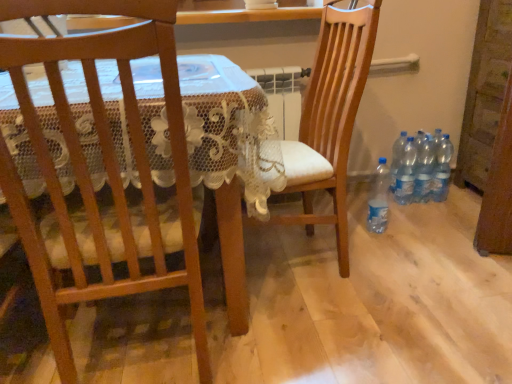
Locate an element on the screen. This screenshot has width=512, height=384. vacant area that lies between wooden chair at center, the 2th chair from the left, and clear plastic bottles at lower right, the 5th bottle positioned from the left is located at coordinates (382, 234).